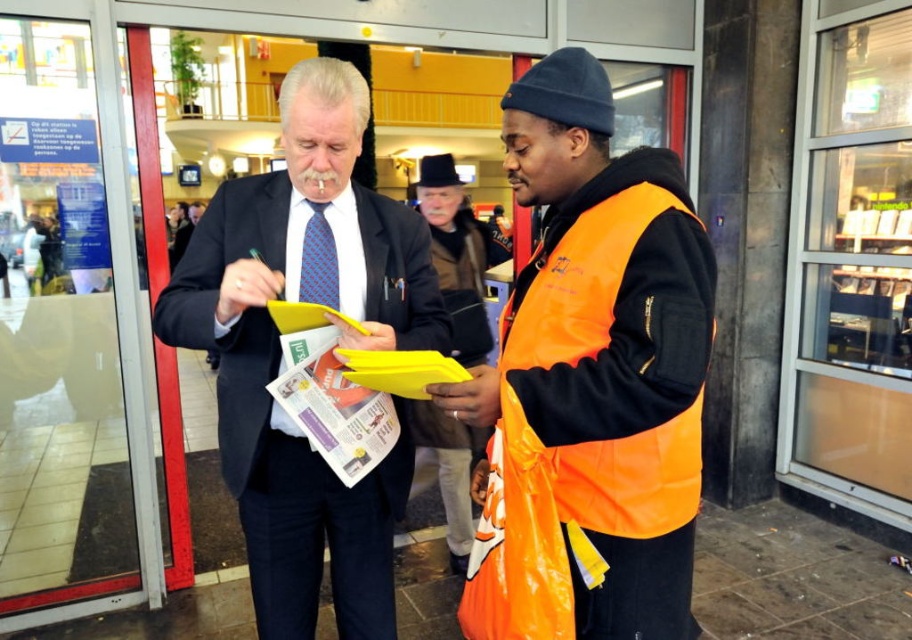
Question: Does matte black suit at center have a greater width compared to blue textured tie at center?

Choices:
 (A) yes
 (B) no

Answer: (A)

Question: Which object appears farthest from the camera in this image?

Choices:
 (A) blue textured tie at center
 (B) orange reflective vest at center

Answer: (A)

Question: Does orange reflective vest at center appear on the left side of matte black suit at center?

Choices:
 (A) no
 (B) yes

Answer: (A)

Question: Which object appears closest to the camera in this image?

Choices:
 (A) matte black suit at center
 (B) blue textured tie at center

Answer: (A)

Question: Based on their relative distances, which object is nearer to the matte black suit at center?

Choices:
 (A) blue textured tie at center
 (B) orange reflective vest at center

Answer: (A)

Question: Can you confirm if orange reflective vest at center is smaller than blue textured tie at center?

Choices:
 (A) no
 (B) yes

Answer: (A)